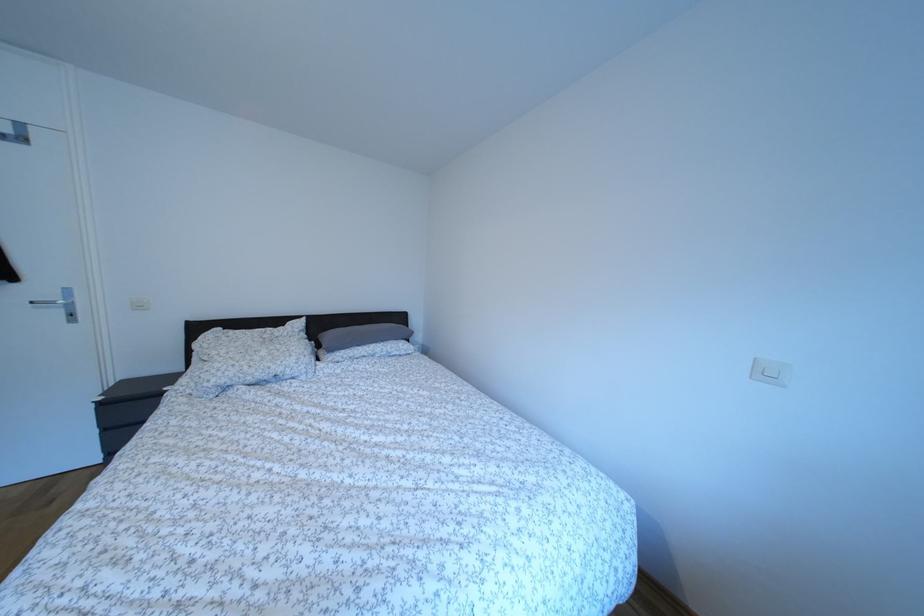
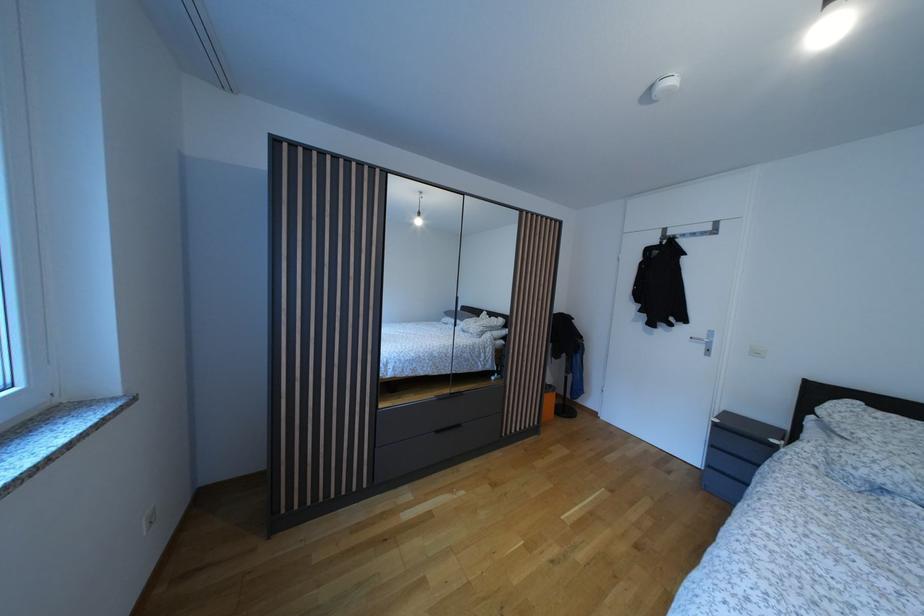
The point at (x=106, y=405) is marked in the first image. Where is the corresponding point in the second image?

(723, 427)